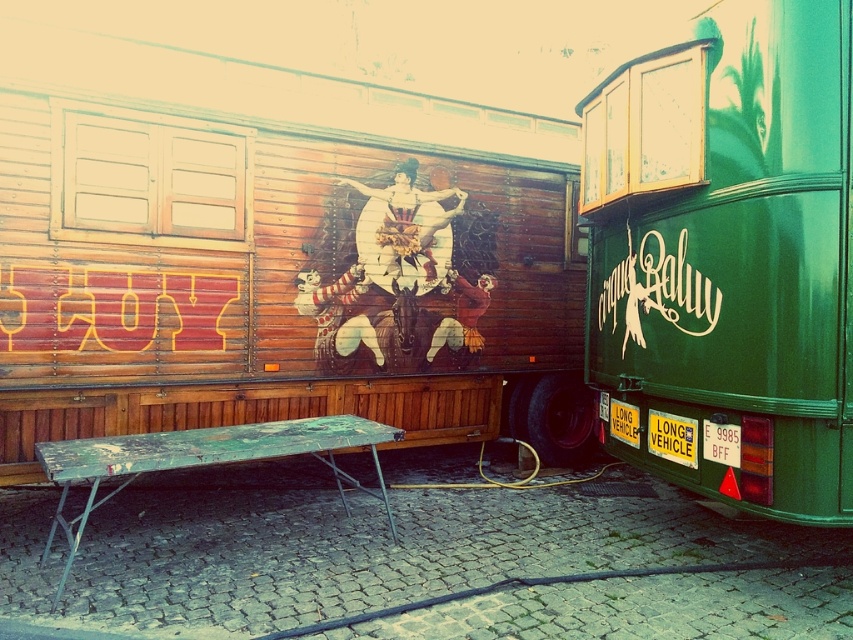
Is the position of rusty metal picnic table at center more distant than that of white plastic license plate at center?

No, rusty metal picnic table at center is closer to the viewer.

Can you confirm if rusty metal picnic table at center is thinner than white plastic license plate at center?

In fact, rusty metal picnic table at center might be wider than white plastic license plate at center.

Is point (155, 449) behind point (722, 449)?

Yes.

Identify the location of rusty metal picnic table at center. (202, 458).

You are a GUI agent. You are given a task and a screenshot of the screen. Output one action in this format:
    pyautogui.click(x=<x>, y=<y>)
    Task: Click on the rusty metal picnic table at center
    This screenshot has width=853, height=640.
    Given the screenshot: What is the action you would take?
    pyautogui.click(x=202, y=458)

Can you confirm if rusty metal picnic table at center is shorter than yellow plastic sign at lower right?

In fact, rusty metal picnic table at center may be taller than yellow plastic sign at lower right.

Is point (74, 540) positioned behind point (651, 435)?

No, it is in front of (651, 435).

The height and width of the screenshot is (640, 853). I want to click on rusty metal picnic table at center, so click(202, 458).

Does wooden table at lower left have a greater height compared to white plastic sign at center?

Correct, wooden table at lower left is much taller as white plastic sign at center.

Between wooden table at lower left and white plastic sign at center, which one is positioned higher?

Positioned higher is wooden table at lower left.

Between point (78, 321) and point (611, 410), which one is positioned in front?

Point (78, 321)

Where is `wooden table at lower left`? wooden table at lower left is located at coordinates (276, 253).